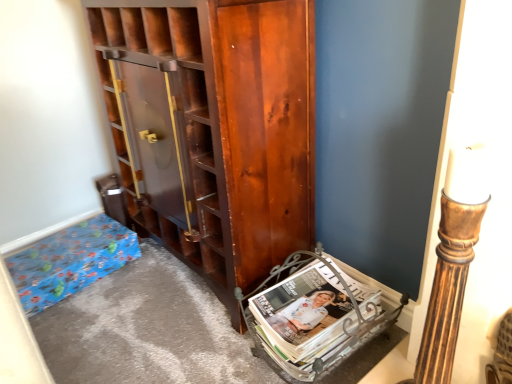
At what (x,y) coordinates should I click in order to perform the action: click on vacant area that lies in front of shiny brown cabinet at center. Please return your answer as a coordinate pair (x, y). Looking at the image, I should click on (165, 335).